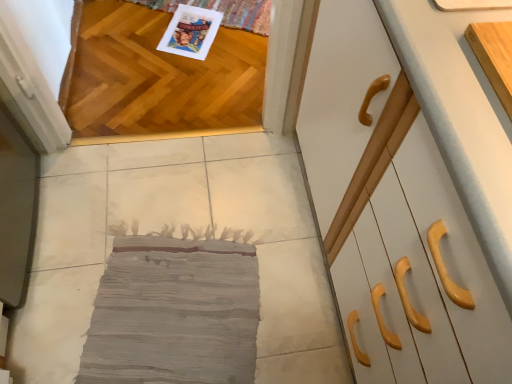
The width and height of the screenshot is (512, 384). Find the location of `vacant area on top of gray fabric rug at center (from a real-world perspective)`. vacant area on top of gray fabric rug at center (from a real-world perspective) is located at coordinates (149, 255).